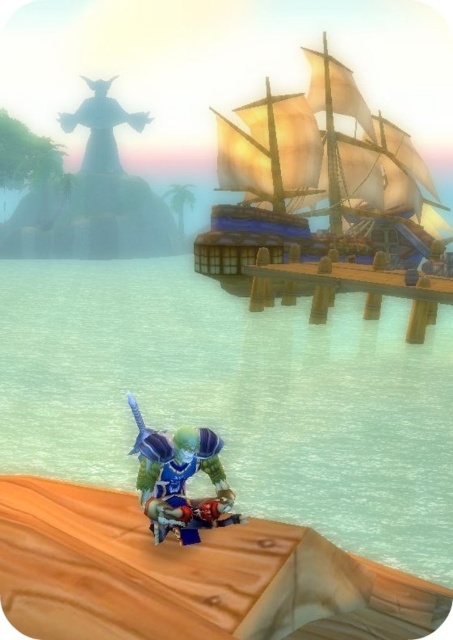
Is translucent blue water at lower center wider than wooden ship at upper right?

Correct, the width of translucent blue water at lower center exceeds that of wooden ship at upper right.

Find the location of a particular element. The height and width of the screenshot is (640, 453). translucent blue water at lower center is located at coordinates (236, 397).

Does translucent blue water at lower center come behind translucent stone statue at upper left?

No, it is not.

Image resolution: width=453 pixels, height=640 pixels. What do you see at coordinates (236, 397) in the screenshot? I see `translucent blue water at lower center` at bounding box center [236, 397].

The height and width of the screenshot is (640, 453). I want to click on translucent blue water at lower center, so click(x=236, y=397).

Which is behind, point (177, 483) or point (90, 134)?

Point (90, 134)

Does blue metallic armor at center have a larger size compared to translucent stone statue at upper left?

Incorrect, blue metallic armor at center is not larger than translucent stone statue at upper left.

Find the location of a particular element. blue metallic armor at center is located at coordinates (179, 480).